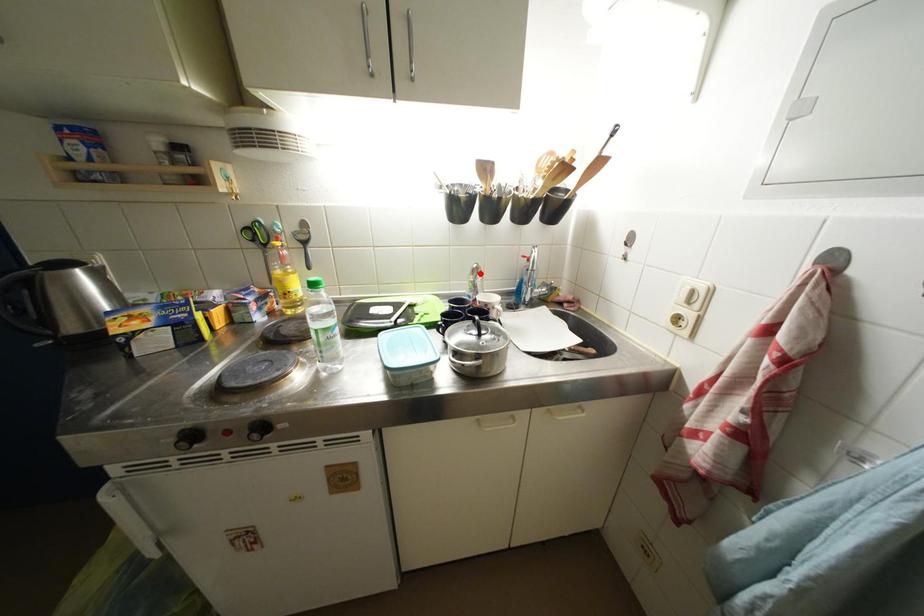
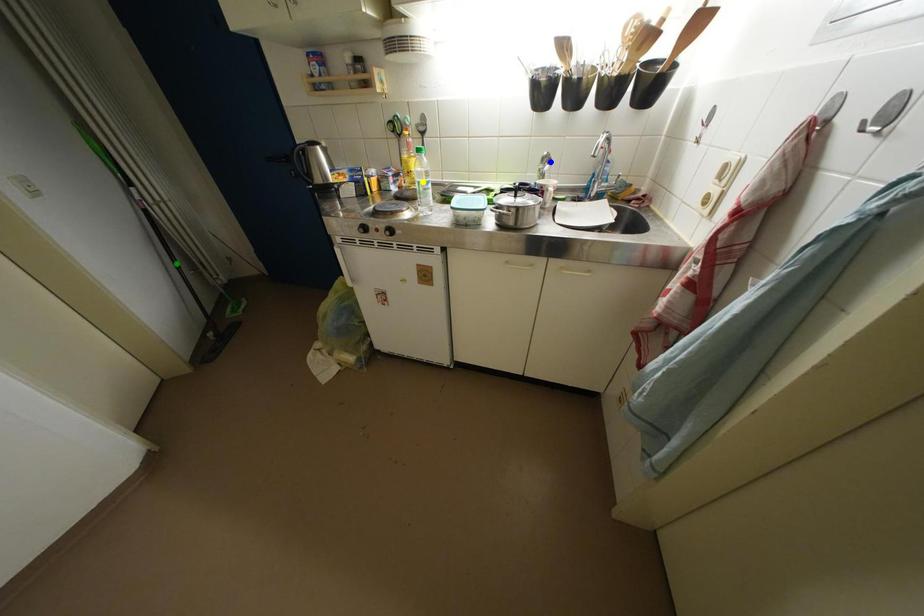
Question: I am providing you with two images of the same scene from different viewpoints. A red point is marked on the first image. You are given multiple points on the second image. Which point in image 2 represents the same 3d spot as the red point in image 1?

Choices:
 (A) green point
 (B) yellow point
 (C) blue point

Answer: (C)